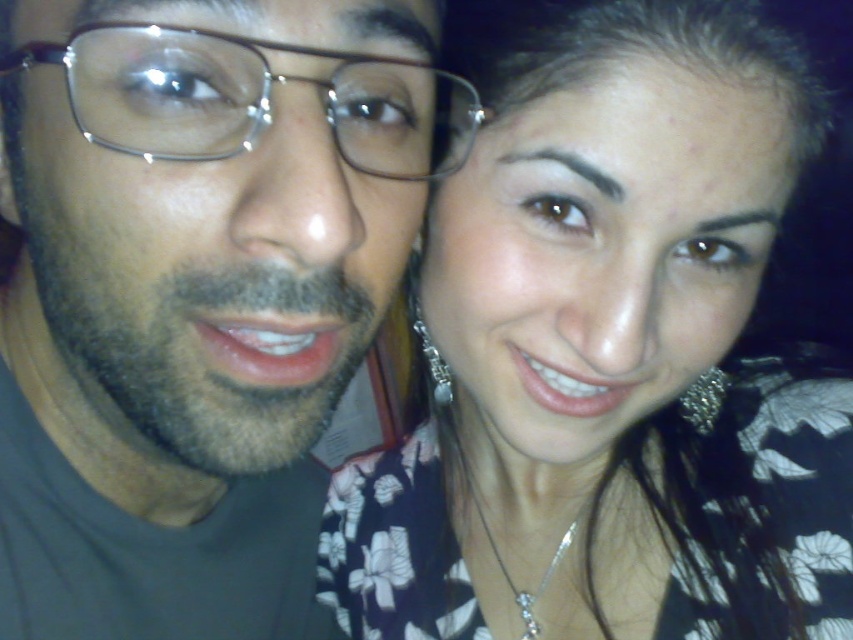
Between point (138, 388) and point (381, 12), which one is positioned behind?

The point (138, 388) is more distant.

Does point (113, 536) come closer to viewer compared to point (383, 10)?

No.

The width and height of the screenshot is (853, 640). Identify the location of matte black face at left. (190, 298).

Can you confirm if brownhaireyebrow at center is positioned below brownhaireyebrow at upper center?

No.

You are a GUI agent. You are given a task and a screenshot of the screen. Output one action in this format:
    pyautogui.click(x=<x>, y=<y>)
    Task: Click on the brownhaireyebrow at center
    
    Given the screenshot: What is the action you would take?
    pyautogui.click(x=569, y=168)

Where is `brownhaireyebrow at center`? brownhaireyebrow at center is located at coordinates (569, 168).

Can you confirm if floral-patterned blouse at center is wider than brownhaireyebrow at upper center?

Yes.

Does floral-patterned blouse at center appear on the left side of brownhaireyebrow at upper center?

Yes, floral-patterned blouse at center is to the left of brownhaireyebrow at upper center.

What do you see at coordinates (610, 362) in the screenshot?
I see `floral-patterned blouse at center` at bounding box center [610, 362].

Locate an element on the screen. The width and height of the screenshot is (853, 640). floral-patterned blouse at center is located at coordinates (610, 362).